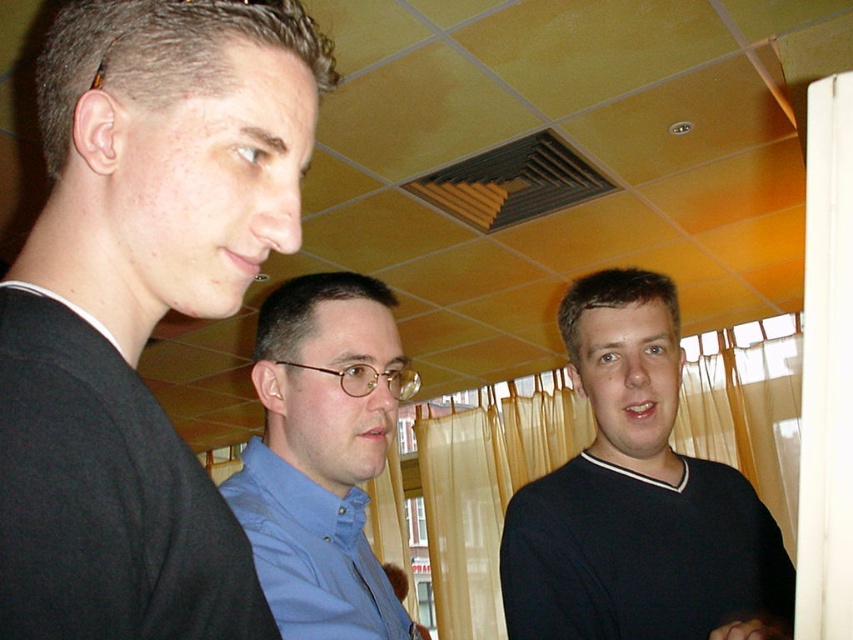
You are a photographer trying to capture a group photo of the three people in the scene. The camera you are using has a focal point at coordinates 0.75, 0.75. Will the person wearing the dark blue sweater at center be in focus?

The dark blue sweater at center is positioned at point (637, 499), which is very close to the camera focal point of (639, 480). Therefore, the person wearing the dark blue sweater at center will be in focus.

You are standing in the room and want to hand a note to the person wearing the black matte shirt at left. Based on their position, where should you approach from to reach them?

Since the black matte shirt at left is located at point (141,307), you should approach from the left side to reach them.

You are standing in the same room as the people in the image. If you want to walk towards the black matte shirt at left, which direction should you move relative to your current position?

The black matte shirt at left is located at point 0.481 on the x axis and 0.166 on the y axis. To move towards it, you should head in the direction where the x coordinate increases to 0.481 and the y coordinate decreases to 0.166.